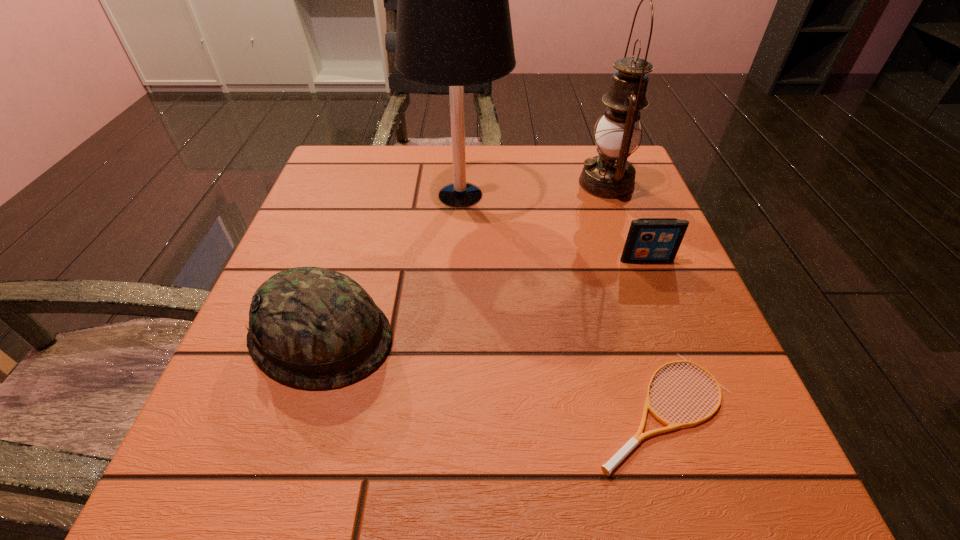
Image resolution: width=960 pixels, height=540 pixels. I want to click on free spot that satisfies the following two spatial constraints: 1. on the front side of the tennis racket; 2. on the right side of the headwear, so click(299, 410).

The width and height of the screenshot is (960, 540). I want to click on free location that satisfies the following two spatial constraints: 1. on the front side of the shortest object; 2. on the right side of the table lamp, so click(448, 410).